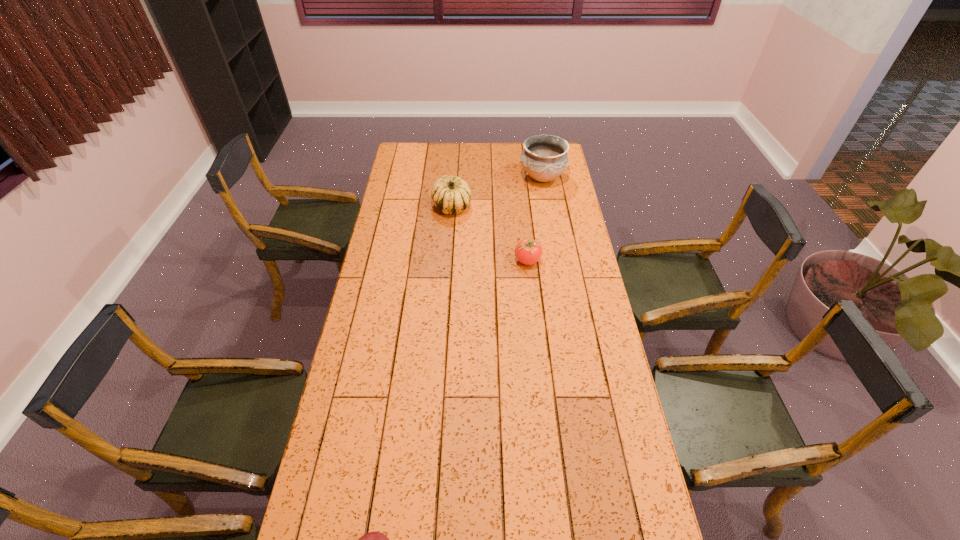
Find the location of a particular element. The height and width of the screenshot is (540, 960). vacant space in between the pottery and the third shortest object is located at coordinates (497, 192).

Find the location of a particular element. empty location between the farther tomato and the second tallest object is located at coordinates (490, 234).

Locate an element on the screen. The height and width of the screenshot is (540, 960). the third closest object to the third farthest object is located at coordinates (372, 539).

Identify which object is located as the second nearest to the second tallest object. Please provide its 2D coordinates. Your answer should be formatted as a tuple, i.e. [(x, y)], where the tuple contains the x and y coordinates of a point satisfying the conditions above.

[(528, 251)]

I want to click on vacant space that satisfies the following two spatial constraints: 1. on the back side of the tallest object; 2. on the right side of the second farthest object, so click(454, 178).

Identify the location of free space that satisfies the following two spatial constraints: 1. on the back side of the pottery; 2. on the right side of the farther tomato. (519, 178).